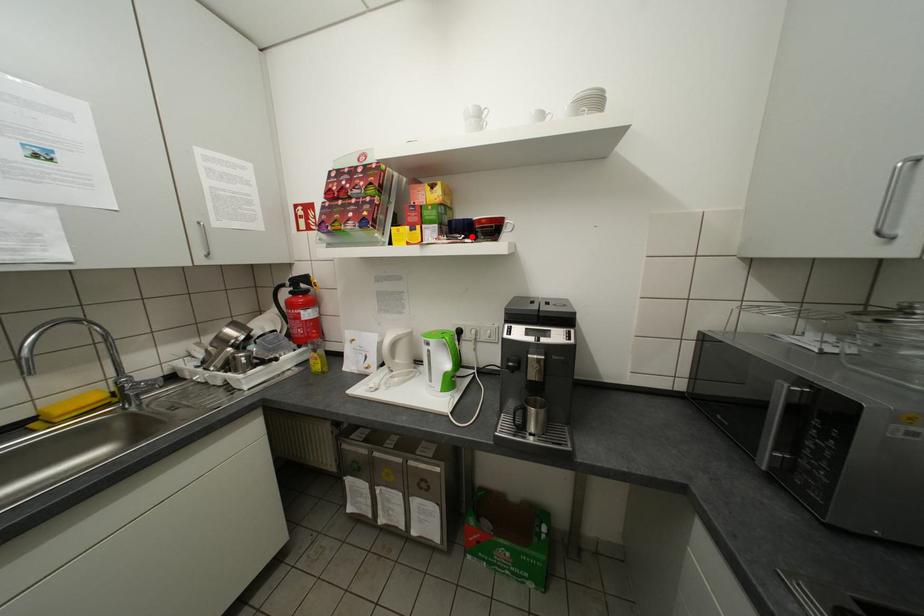
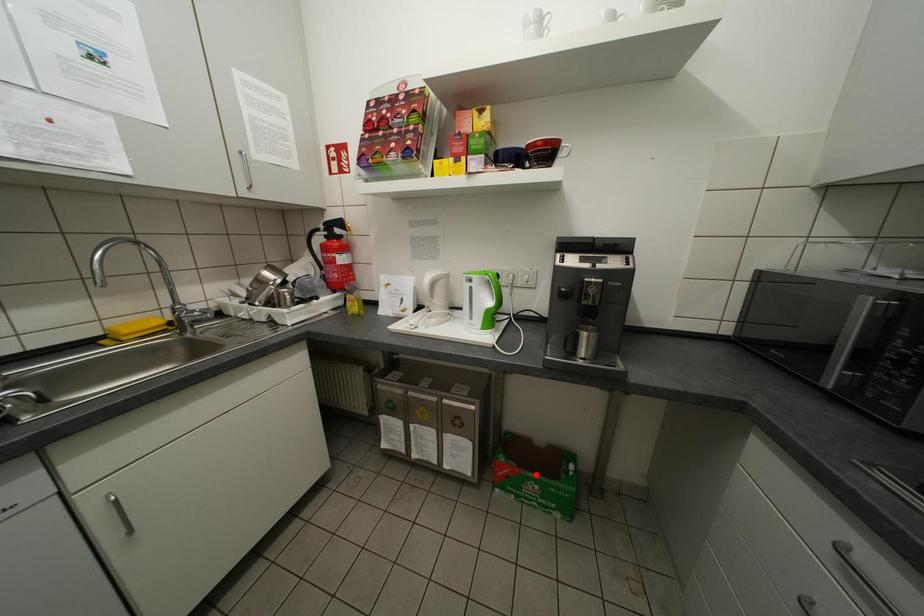
I am providing you with two images of the same scene from different viewpoints. A red point is marked on the first image and another point is marked on the second image. Does the point marked in image1 correspond to the same location as the one in image2?

No